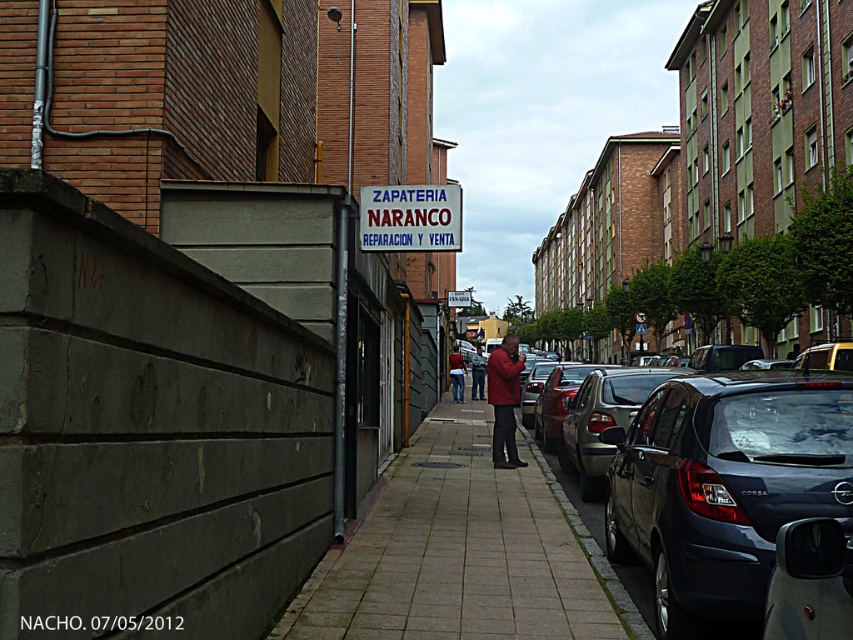
Between point (635, 492) and point (474, 388), which one is positioned in front?

Point (635, 492) is in front.

Is matte black corsa at center wider than dark blue jeans at center?

Indeed, matte black corsa at center has a greater width compared to dark blue jeans at center.

Identify the location of matte black corsa at center. (722, 484).

Can you confirm if white plastic sign at center is positioned to the right of red leather jacket at center?

Incorrect, white plastic sign at center is not on the right side of red leather jacket at center.

The height and width of the screenshot is (640, 853). Find the location of `white plastic sign at center`. white plastic sign at center is located at coordinates (410, 218).

Does matte red jacket at center come behind dark blue jeans at center?

No, matte red jacket at center is in front of dark blue jeans at center.

This screenshot has height=640, width=853. What do you see at coordinates (503, 400) in the screenshot?
I see `matte red jacket at center` at bounding box center [503, 400].

The width and height of the screenshot is (853, 640). In order to click on matte red jacket at center in this screenshot , I will do `click(503, 400)`.